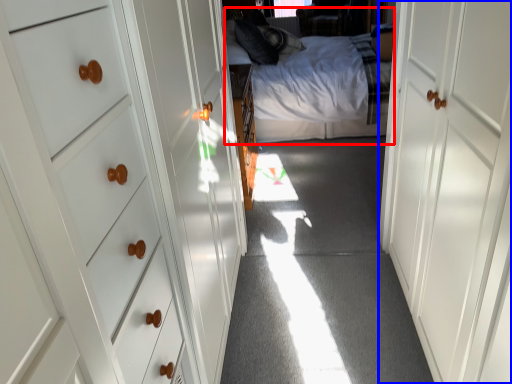
Question: Which point is further to the camera, bed (highlighted by a red box) or door (highlighted by a blue box)?

Choices:
 (A) bed
 (B) door

Answer: (A)